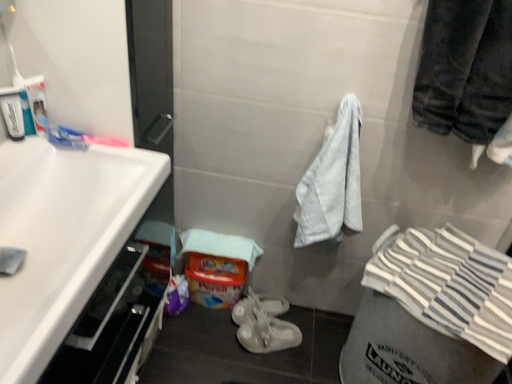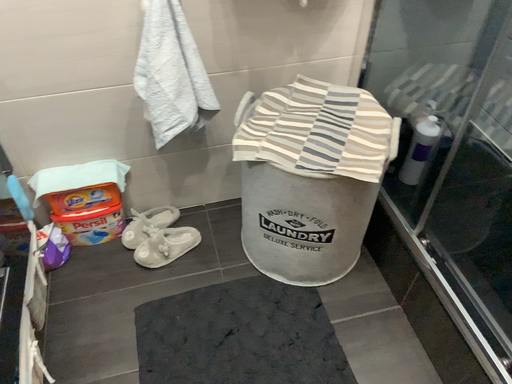
Question: Which way did the camera rotate in the video?

Choices:
 (A) rotated right
 (B) rotated left

Answer: (A)